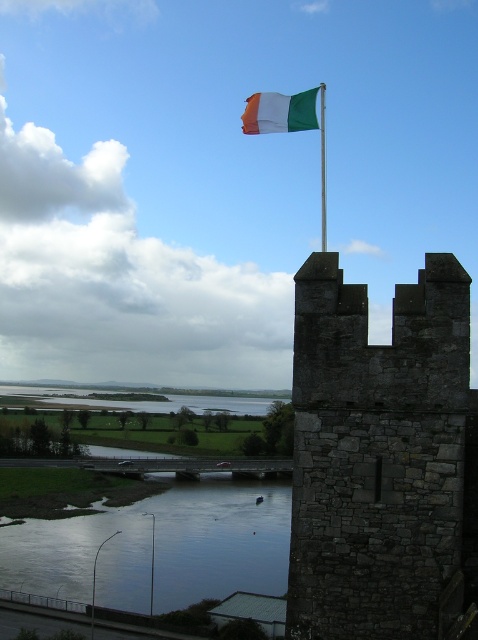
Which is above, green fabric flag pole at upper center or metallic pole at lower left?

Positioned higher is green fabric flag pole at upper center.

Does green fabric flag pole at upper center appear over metallic pole at lower left?

Correct, green fabric flag pole at upper center is located above metallic pole at lower left.

This screenshot has height=640, width=478. Describe the element at coordinates (323, 168) in the screenshot. I see `green fabric flag pole at upper center` at that location.

Image resolution: width=478 pixels, height=640 pixels. I want to click on green fabric flag pole at upper center, so click(x=323, y=168).

Which is more to the right, smooth reflective water at lower center or metallic flagpole at upper center?

smooth reflective water at lower center is more to the right.

Is point (159, 525) farther from camera compared to point (151, 598)?

Yes.

Identify the location of smooth reflective water at lower center. (159, 547).

Is smooth reflective water at lower center smaller than metallic pole at lower left?

Actually, smooth reflective water at lower center might be larger than metallic pole at lower left.

In order to click on smooth reflective water at lower center in this screenshot , I will do `click(159, 547)`.